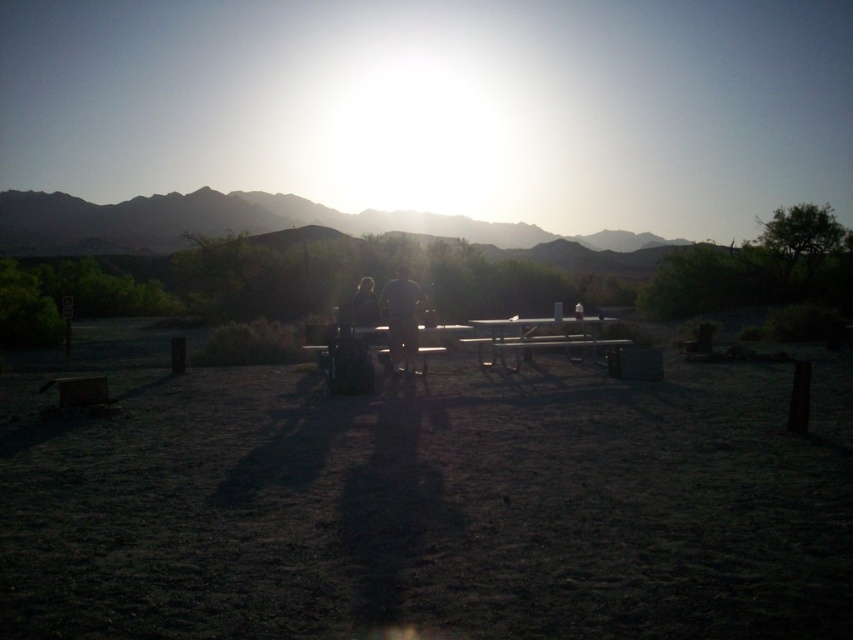
You are planning to set up a tent near the metallic silver table at center and the rugged brown mountain at upper center. Which object should you place your tent closer to if you want it to be in the shade provided by the mountain?

You should place your tent closer to the rugged brown mountain at upper center because the metallic silver table at center is behind it, meaning the mountain would cast a larger shadow in that area.

You are standing at the point with coordinates 0.5, 0.5 in the image. You want to walk to the dirt field at center. In which direction should you move?

The dirt field at center is located at point (x=425, y=504). Since your current position is (x=426, y=320), you should move to the right to reach the dirt field at center.